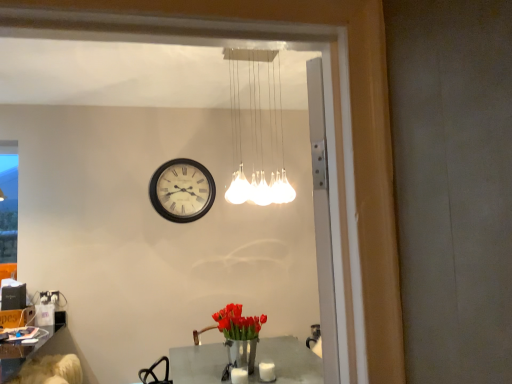
You are a GUI agent. You are given a task and a screenshot of the screen. Output one action in this format:
    pyautogui.click(x=<x>, y=<y>)
    Task: Click on the vacant space behind white matte candle at lower center, the first candle in the left-to-right sequence
    This screenshot has height=384, width=512.
    Given the screenshot: What is the action you would take?
    pyautogui.click(x=243, y=368)